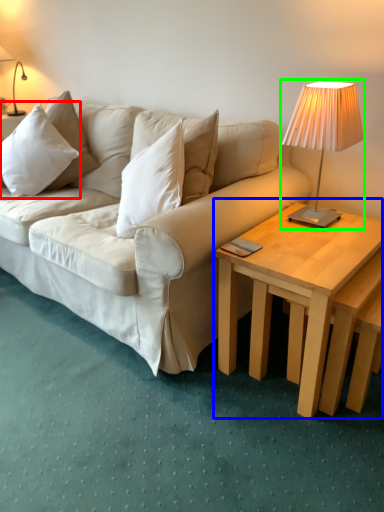
Question: Considering the real-world distances, which object is closest to pillow (highlighted by a red box)? coffee table (highlighted by a blue box) or lamp (highlighted by a green box).

Choices:
 (A) coffee table
 (B) lamp

Answer: (B)